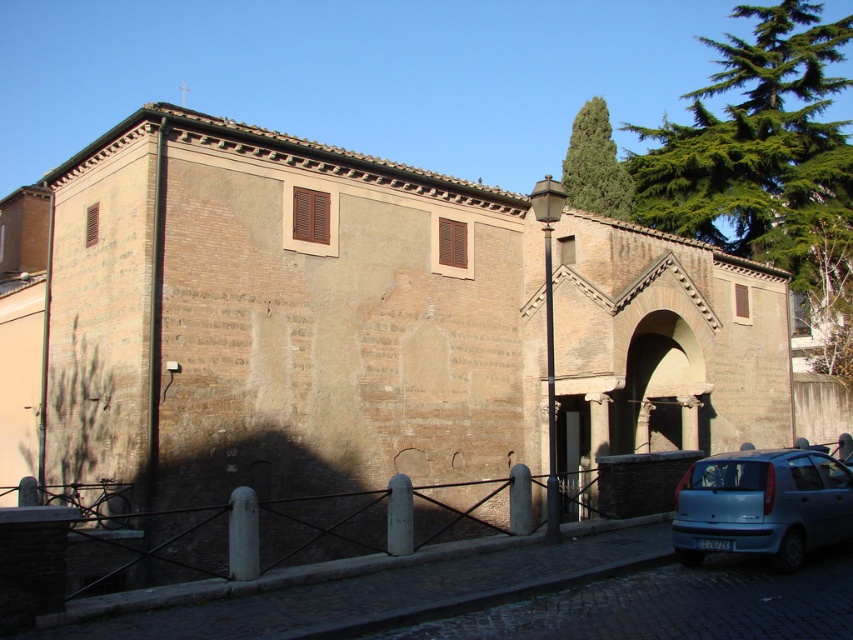
Question: Which point is closer to the camera taking this photo?

Choices:
 (A) (715, 540)
 (B) (631, 125)
 (C) (705, 476)
 (D) (608, 148)

Answer: (A)

Question: Does green needle-like leaves at upper right appear under blue matte car at lower right?

Choices:
 (A) yes
 (B) no

Answer: (B)

Question: Which of the following is the closest to the observer?

Choices:
 (A) (717, 540)
 (B) (727, 461)

Answer: (A)

Question: From the image, what is the correct spatial relationship of green needle-like leaves at upper right in relation to whiteplasticlicense plate at lower center?

Choices:
 (A) right
 (B) left

Answer: (A)

Question: Can you confirm if blue matte car at lower right is positioned to the left of whiteplasticlicense plate at lower center?

Choices:
 (A) yes
 (B) no

Answer: (B)

Question: Which point is closer to the camera?

Choices:
 (A) smooth stone archway at center
 (B) whiteplasticlicense plate at lower center
 (C) green needle-like leaves at upper right
 (D) blue matte car at lower right

Answer: (D)